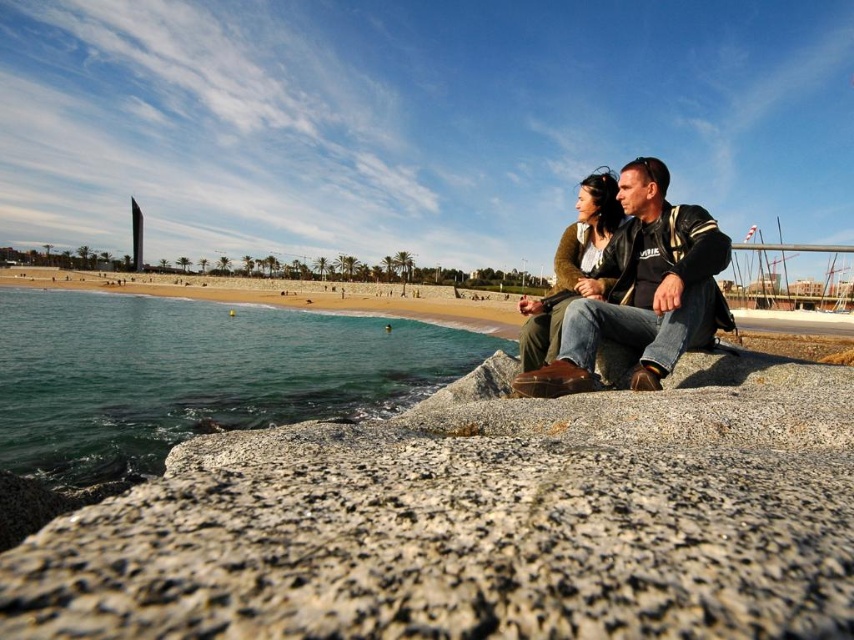
Is leather jacket at center shorter than smooth sand beach at center?

Yes, leather jacket at center is shorter than smooth sand beach at center.

Between leather jacket at center and smooth sand beach at center, which one is positioned higher?

Positioned higher is smooth sand beach at center.

Locate an element on the screen. leather jacket at center is located at coordinates (642, 291).

Between granite rock at center and green fabric jacket at center, which one appears on the right side from the viewer's perspective?

From the viewer's perspective, green fabric jacket at center appears more on the right side.

Does point (344, 573) come behind point (613, 196)?

No, it is not.

This screenshot has width=854, height=640. I want to click on granite rock at center, so click(480, 522).

Is granite rock at center above green water at lower left?

Incorrect, granite rock at center is not positioned above green water at lower left.

Does granite rock at center have a lesser height compared to green water at lower left?

Yes, granite rock at center is shorter than green water at lower left.

Does point (4, 588) come in front of point (68, 413)?

Yes, it is.

I want to click on granite rock at center, so click(x=480, y=522).